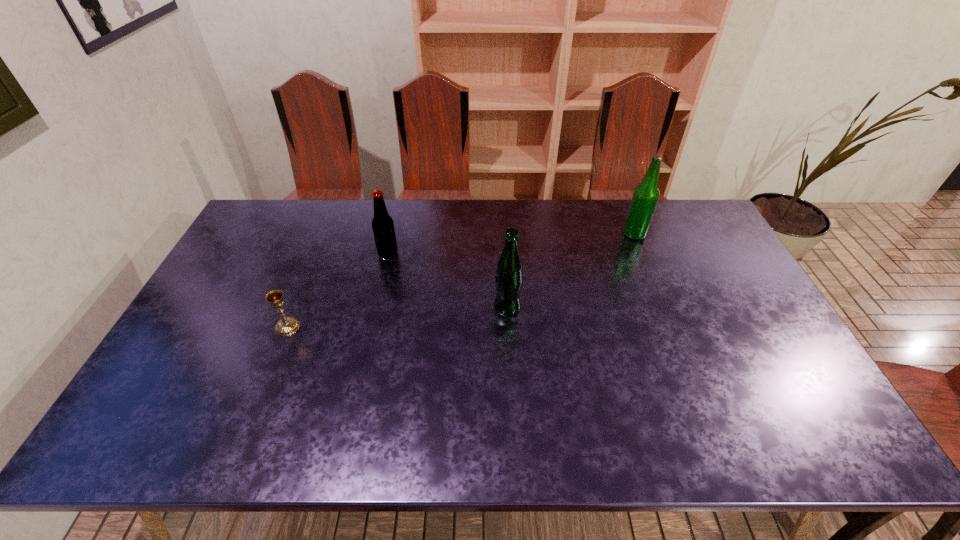
The height and width of the screenshot is (540, 960). What are the coordinates of `free space at the near right corner of the desktop` in the screenshot? It's located at (795, 416).

At what (x,y) coordinates should I click in order to perform the action: click on free space between the third object from left to right and the farthest beer bottle. Please return your answer as a coordinate pair (x, y). The width and height of the screenshot is (960, 540). Looking at the image, I should click on (571, 271).

Locate an element on the screen. free area in between the second object from right to left and the leftmost beer bottle is located at coordinates (447, 281).

Find the location of a particular element. free area in between the shortest object and the second beer bottle from right to left is located at coordinates (397, 317).

I want to click on vacant region between the second beer bottle from left to right and the chalice, so click(397, 317).

In order to click on free point between the second shortest object and the leftmost object in this screenshot , I will do `click(338, 291)`.

This screenshot has height=540, width=960. What are the coordinates of `vacant point located between the second shortest object and the shortest object` in the screenshot? It's located at (338, 291).

The width and height of the screenshot is (960, 540). I want to click on free area in between the nearest beer bottle and the chalice, so click(x=397, y=317).

The width and height of the screenshot is (960, 540). I want to click on unoccupied area between the shortest object and the third tallest object, so click(x=338, y=291).

Locate an element on the screen. The image size is (960, 540). free spot between the second farthest object and the chalice is located at coordinates (338, 291).